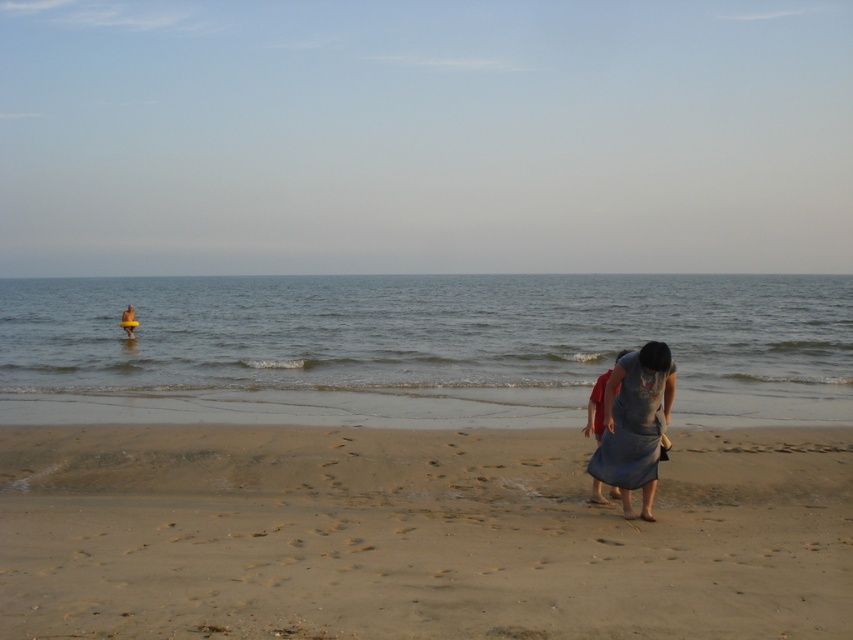
Which is above, clear blue water at center or denim dress at lower right?

Positioned higher is clear blue water at center.

Does point (78, 301) come in front of point (657, 444)?

That is False.

Is point (83, 339) more distant than point (614, 472)?

Yes, point (83, 339) is farther from viewer.

Image resolution: width=853 pixels, height=640 pixels. Find the location of `clear blue water at center`. clear blue water at center is located at coordinates (422, 332).

Can you confirm if sandy beach at lower center is positioned above yellow rubber ring at center?

No.

Does sandy beach at lower center have a lesser width compared to yellow rubber ring at center?

No.

Between point (25, 440) and point (122, 312), which one is positioned behind?

The point (122, 312) is behind.

This screenshot has width=853, height=640. Identify the location of sandy beach at lower center. [x=416, y=534].

Can you confirm if denim skirt at lower right is positioned below yellow rubber ring at center?

Indeed, denim skirt at lower right is positioned under yellow rubber ring at center.

Can you confirm if denim skirt at lower right is positioned to the right of yellow rubber ring at center?

Yes, denim skirt at lower right is to the right of yellow rubber ring at center.

Identify the location of denim skirt at lower right. Image resolution: width=853 pixels, height=640 pixels. (596, 408).